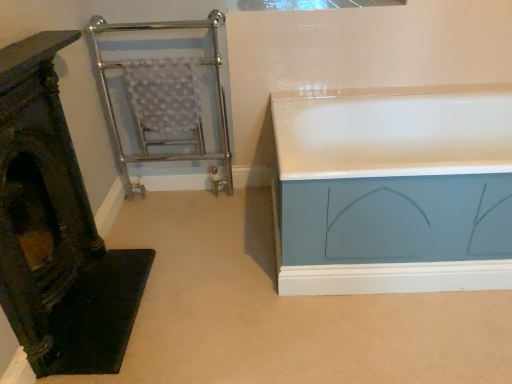
Find the location of a particular element. The width and height of the screenshot is (512, 384). free spot below wooden carved chair at left (from a real-world perspective) is located at coordinates (75, 295).